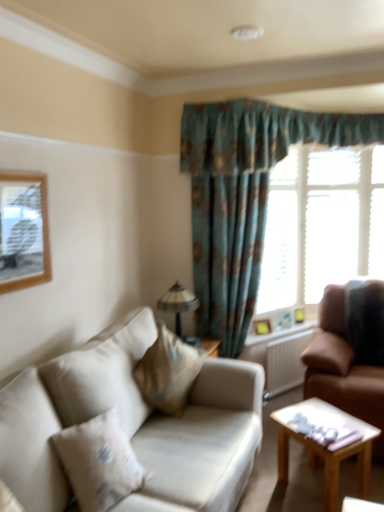
Question: Is matte glass lampshade at center situated inside light brown wooden coffee table at lower right or outside?

Choices:
 (A) outside
 (B) inside

Answer: (A)

Question: Considering the positions of point (185, 309) and point (347, 418), is point (185, 309) closer or farther from the camera than point (347, 418)?

Choices:
 (A) farther
 (B) closer

Answer: (A)

Question: Which object is positioned farthest from the white wooden blinds at upper right?

Choices:
 (A) wooden picture frame at right, arranged as the second picture frame when viewed from the front
 (B) brown textured pillow at right, the first pillow from the right
 (C) white plastic radiator at lower right
 (D) light brown wooden coffee table at lower right
 (E) beige fabric couch at lower left, arranged as the 2th studio couch when viewed from the right

Answer: (E)

Question: Based on their relative distances, which object is nearer to the matte glass lampshade at center?

Choices:
 (A) light brown wooden coffee table at lower right
 (B) wooden picture frame at right, the 1th picture frame when ordered from back to front
 (C) beige fabric couch at lower left, arranged as the 2th studio couch when viewed from the right
 (D) beige fabric pillow at lower left, which is the 1th pillow in left-to-right order
 (E) brown leather couch at right, positioned as the first studio couch in right-to-left order

Answer: (B)